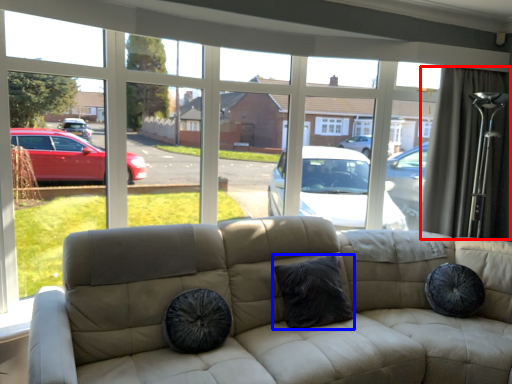
Question: Which object appears farthest to the camera in this image, curtain (highlighted by a red box) or pillow (highlighted by a blue box)?

Choices:
 (A) curtain
 (B) pillow

Answer: (A)